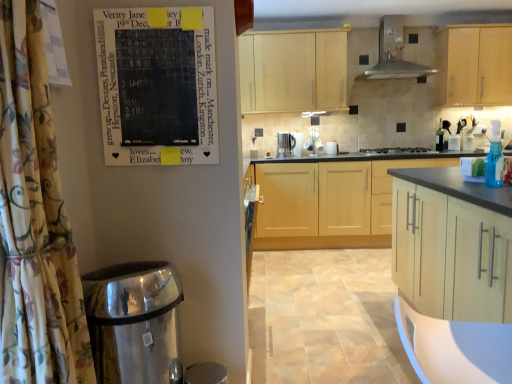
The image size is (512, 384). What do you see at coordinates (314, 142) in the screenshot?
I see `satin silver kettle at center, which appears as the 2th appliance when viewed from the right` at bounding box center [314, 142].

The image size is (512, 384). What do you see at coordinates (330, 199) in the screenshot?
I see `light wood cabinet at center, which is the 2th cabinetry in front-to-back order` at bounding box center [330, 199].

Measure the distance between floral fabric shower curtain at left and camera.

floral fabric shower curtain at left and camera are 39.19 inches apart.

At what (x,y) coordinates should I click in order to perform the action: click on black stainless steel gas stove at center. Please return your answer as a coordinate pair (x, y). The width and height of the screenshot is (512, 384). Looking at the image, I should click on (395, 150).

Measure the distance between point (365, 149) and camera.

Point (365, 149) is 4.51 meters from camera.

Locate an element on the screen. light wood cabinet at center, positioned as the fourth cabinetry in back-to-front order is located at coordinates (452, 245).

What is the approximate width of blue glass bottle at right?

blue glass bottle at right is 5.03 inches wide.

Locate an element on the screen. The width and height of the screenshot is (512, 384). metallic silver kettle at center, the third appliance from the left is located at coordinates (331, 148).

Where is `satin silver kettle at center, which appears as the 2th appliance when viewed from the right`? satin silver kettle at center, which appears as the 2th appliance when viewed from the right is located at coordinates click(x=314, y=142).

Is satin silver kettle at center, which is the third appliance from right to left, wider than black stainless steel gas stove at center?

Incorrect, the width of satin silver kettle at center, which is the third appliance from right to left, does not surpass that of black stainless steel gas stove at center.

Which of these two, satin silver kettle at center, marked as the first appliance in a left-to-right arrangement, or black stainless steel gas stove at center, is bigger?

Bigger between the two is black stainless steel gas stove at center.

From a real-world perspective, is satin silver kettle at center, which is the third appliance from right to left, physically above black stainless steel gas stove at center?

Yes, from a real-world perspective, satin silver kettle at center, which is the third appliance from right to left, is above black stainless steel gas stove at center.

Which is further, [295,152] or [380,148]?

Point [380,148]

Is satin silver kettle at center, which appears as the 2th appliance when viewed from the right, beside black stainless steel gas stove at center?

satin silver kettle at center, which appears as the 2th appliance when viewed from the right, and black stainless steel gas stove at center are clearly separated.

Considering the sizes of objects satin silver kettle at center, which appears as the 2th appliance when viewed from the right, and black stainless steel gas stove at center in the image provided, who is taller, satin silver kettle at center, which appears as the 2th appliance when viewed from the right, or black stainless steel gas stove at center?

With more height is satin silver kettle at center, which appears as the 2th appliance when viewed from the right.

Is satin silver kettle at center, which appears as the 2th appliance when viewed from the right, looking in the opposite direction of black stainless steel gas stove at center?

satin silver kettle at center, which appears as the 2th appliance when viewed from the right, does not have its back to black stainless steel gas stove at center.

Who is smaller, satin silver kettle at center, which is the second appliance from left to right, or black stainless steel gas stove at center?

Smaller between the two is satin silver kettle at center, which is the second appliance from left to right.

Is point (424, 248) farther from viewer compared to point (459, 84)?

No, (424, 248) is in front of (459, 84).

In the scene shown: From the image's perspective, is light wood cabinet at center, positioned as the first cabinetry in front-to-back order, above light wood cabinet at upper right, acting as the 3th cabinetry starting from the front?

No, from the image's perspective, light wood cabinet at center, positioned as the first cabinetry in front-to-back order, is not on top of light wood cabinet at upper right, acting as the 3th cabinetry starting from the front.

From a real-world perspective, is light wood cabinet at center, positioned as the first cabinetry in front-to-back order, physically above light wood cabinet at upper right, which is the 2th cabinetry from back to front?

No, from a real-world perspective, light wood cabinet at center, positioned as the first cabinetry in front-to-back order, is not above light wood cabinet at upper right, which is the 2th cabinetry from back to front.

Is light wood cabinet at center, positioned as the fourth cabinetry in back-to-front order, aimed at light wood cabinet at upper right, acting as the 3th cabinetry starting from the front?

No.

From a real-world perspective, is satin silver coffee maker at center located higher than light wood cabinet at upper right, which is the 2th cabinetry from back to front?

Actually, satin silver coffee maker at center is physically below light wood cabinet at upper right, which is the 2th cabinetry from back to front, in the real world.

Is satin silver coffee maker at center further to camera compared to light wood cabinet at upper right, which is the 2th cabinetry from back to front?

Yes, satin silver coffee maker at center is further from the camera.

From their relative heights in the image, would you say satin silver coffee maker at center is taller or shorter than light wood cabinet at upper right, acting as the 3th cabinetry starting from the front?

In the image, satin silver coffee maker at center appears to be shorter than light wood cabinet at upper right, acting as the 3th cabinetry starting from the front.

From the image's perspective, is satin silver coffee maker at center over light wood cabinet at upper right, which is the 2th cabinetry from back to front?

No, from the image's perspective, satin silver coffee maker at center is not over light wood cabinet at upper right, which is the 2th cabinetry from back to front.

Is satin silver kettle at center, which is the third appliance from right to left, not close to satin silver kettle at center, which appears as the 2th appliance when viewed from the right?

No, satin silver kettle at center, which is the third appliance from right to left, is not far from satin silver kettle at center, which appears as the 2th appliance when viewed from the right.

Relative to satin silver kettle at center, which appears as the 2th appliance when viewed from the right, is satin silver kettle at center, marked as the first appliance in a left-to-right arrangement, in front or behind?

Clearly, satin silver kettle at center, marked as the first appliance in a left-to-right arrangement, is behind satin silver kettle at center, which appears as the 2th appliance when viewed from the right.

Can you confirm if satin silver kettle at center, marked as the first appliance in a left-to-right arrangement, is shorter than satin silver kettle at center, which is the second appliance from left to right?

Yes.

Who is bigger, satin silver kettle at center, which is the third appliance from right to left, or light wood cabinet at upper right, acting as the 3th cabinetry starting from the front?

Bigger between the two is light wood cabinet at upper right, acting as the 3th cabinetry starting from the front.

Identify the location of the 2nd cabinetry in front of the satin silver kettle at center, marked as the first appliance in a left-to-right arrangement. (474, 66).

Considering the relative sizes of satin silver kettle at center, which is the third appliance from right to left, and light wood cabinet at upper right, which is the 2th cabinetry from back to front, in the image provided, is satin silver kettle at center, which is the third appliance from right to left, wider than light wood cabinet at upper right, which is the 2th cabinetry from back to front,?

Incorrect, the width of satin silver kettle at center, which is the third appliance from right to left, does not surpass that of light wood cabinet at upper right, which is the 2th cabinetry from back to front.

Is satin silver kettle at center, which is the third appliance from right to left, next to light wood cabinet at upper right, which is the 2th cabinetry from back to front?

No, satin silver kettle at center, which is the third appliance from right to left, is not in contact with light wood cabinet at upper right, which is the 2th cabinetry from back to front.

Based on the photo, considering the sizes of satin silver kettle at center, which appears as the 2th appliance when viewed from the right, and floral fabric shower curtain at left in the image, is satin silver kettle at center, which appears as the 2th appliance when viewed from the right, taller or shorter than floral fabric shower curtain at left?

Considering their sizes, satin silver kettle at center, which appears as the 2th appliance when viewed from the right, has less height than floral fabric shower curtain at left.

Identify the location of shower curtain that is under the satin silver kettle at center, which is the second appliance from left to right (from a real-world perspective). Image resolution: width=512 pixels, height=384 pixels. (35, 219).

Between satin silver kettle at center, which is the second appliance from left to right, and floral fabric shower curtain at left, which one has smaller size?

satin silver kettle at center, which is the second appliance from left to right.

Where is `gas stove beneath the satin silver kettle at center, which is the third appliance from right to left (from a real-world perspective)`? The width and height of the screenshot is (512, 384). gas stove beneath the satin silver kettle at center, which is the third appliance from right to left (from a real-world perspective) is located at coordinates (395, 150).

You are a GUI agent. You are given a task and a screenshot of the screen. Output one action in this format:
    pyautogui.click(x=<x>, y=<y>)
    Task: Click on the 1st appliance behind when counting from the black stainless steel gas stove at center
    This screenshot has width=512, height=384.
    Given the screenshot: What is the action you would take?
    pyautogui.click(x=314, y=142)

Estimate the real-world distances between objects in this image. Which object is further from satin silver kettle at center, which appears as the 2th appliance when viewed from the right, blue glass bottle at right or satin silver kettle at center, marked as the first appliance in a left-to-right arrangement?

blue glass bottle at right.

From the picture: Estimate the real-world distances between objects in this image. Which object is closer to matte black poster at upper left, blue glass bottle at right or metallic silver kettle at center, the 1th appliance viewed from the right?

The object closer to matte black poster at upper left is blue glass bottle at right.

Looking at the image, which one is located closer to light wood cabinet at upper center, which is counted as the first cabinetry, starting from the back, light wood cabinet at center, positioned as the first cabinetry in front-to-back order, or black stainless steel gas stove at center?

black stainless steel gas stove at center.

Consider the image. Which object lies further to the anchor point metallic silver kettle at center, the third appliance from the left, light wood cabinet at upper center, the fourth cabinetry positioned from the front, or metallic stainless steel range hood at upper center?

metallic stainless steel range hood at upper center is positioned further to the anchor metallic silver kettle at center, the third appliance from the left.

Estimate the real-world distances between objects in this image. Which object is further from satin silver kettle at center, marked as the first appliance in a left-to-right arrangement, polished stainless steel water heater at lower left or light wood cabinet at upper right, acting as the 3th cabinetry starting from the front?

polished stainless steel water heater at lower left lies further to satin silver kettle at center, marked as the first appliance in a left-to-right arrangement, than the other object.

Looking at this image, considering their positions, is light wood cabinet at upper center, the fourth cabinetry positioned from the front, positioned further to light wood cabinet at center, positioned as the first cabinetry in front-to-back order, than satin silver kettle at center, which appears as the 2th appliance when viewed from the right?

satin silver kettle at center, which appears as the 2th appliance when viewed from the right, is positioned further to the anchor light wood cabinet at center, positioned as the first cabinetry in front-to-back order.

When comparing their distances from satin silver coffee maker at center, does light wood cabinet at upper center, the fourth cabinetry positioned from the front, or light wood cabinet at center, positioned as the first cabinetry in front-to-back order, seem closer?

light wood cabinet at upper center, the fourth cabinetry positioned from the front, is positioned closer to the anchor satin silver coffee maker at center.

Considering their positions, is metallic silver kettle at center, the third appliance from the left, positioned further to metallic stainless steel range hood at upper center than floral fabric shower curtain at left?

floral fabric shower curtain at left is further to metallic stainless steel range hood at upper center.

Where is `bulletin board between light wood cabinet at center, positioned as the fourth cabinetry in back-to-front order, and satin silver coffee maker at center, along the z-axis`? Image resolution: width=512 pixels, height=384 pixels. bulletin board between light wood cabinet at center, positioned as the fourth cabinetry in back-to-front order, and satin silver coffee maker at center, along the z-axis is located at coordinates (157, 85).

Where is `home appliance positioned between polished stainless steel water heater at lower left and black stainless steel gas stove at center from near to far`? home appliance positioned between polished stainless steel water heater at lower left and black stainless steel gas stove at center from near to far is located at coordinates (394, 53).

Identify the location of bottle between floral fabric shower curtain at left and metallic stainless steel range hood at upper center from front to back. (495, 158).

Find the location of `gas stove positioned between light wood cabinet at center, positioned as the fourth cabinetry in back-to-front order, and light wood cabinet at upper center, which is counted as the first cabinetry, starting from the back, from near to far`. gas stove positioned between light wood cabinet at center, positioned as the fourth cabinetry in back-to-front order, and light wood cabinet at upper center, which is counted as the first cabinetry, starting from the back, from near to far is located at coordinates (395, 150).